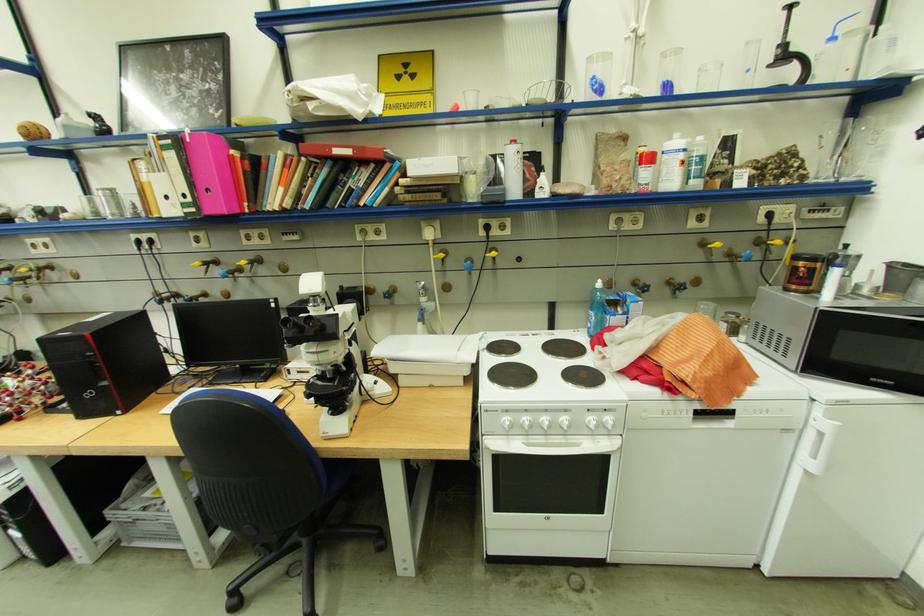
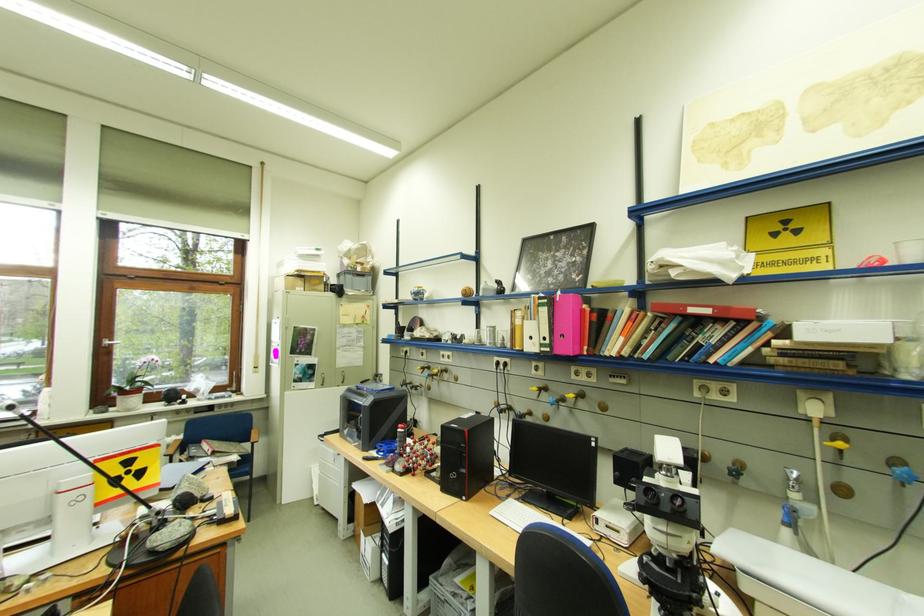
Locate, in the second image, the point that corresponds to the point at 407,376 in the first image.

(763, 601)